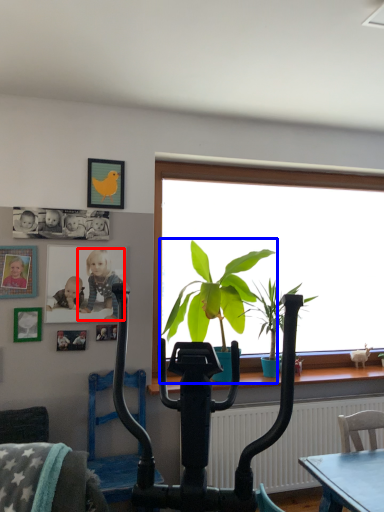
Question: Which point is further to the camera, person (highlighted by a red box) or houseplant (highlighted by a blue box)?

Choices:
 (A) person
 (B) houseplant

Answer: (A)